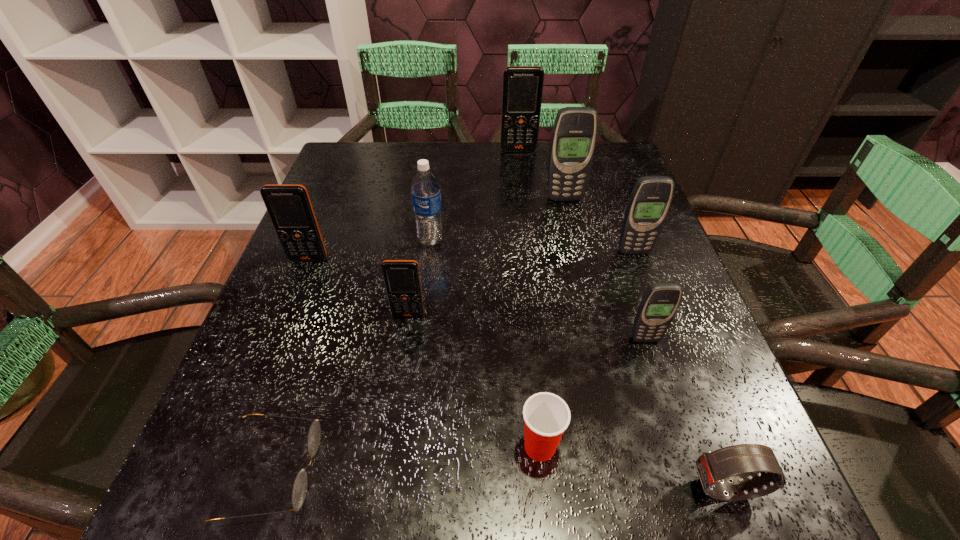
Where is `the second nearest cellular telephone`? the second nearest cellular telephone is located at coordinates (402, 281).

At what (x,y) coordinates should I click in order to perform the action: click on the smallest gray cellular telephone. Please return your answer as a coordinate pair (x, y). Image resolution: width=960 pixels, height=540 pixels. Looking at the image, I should click on (660, 302).

Where is `the nearest cellular telephone`? Image resolution: width=960 pixels, height=540 pixels. the nearest cellular telephone is located at coordinates (660, 302).

Identify the location of Dixie cup. (546, 416).

Where is `watch`? watch is located at coordinates (734, 462).

Find the location of a particular element. This screenshot has width=960, height=540. gold spectacles is located at coordinates (299, 491).

This screenshot has height=540, width=960. I want to click on the shortest object, so click(299, 491).

You are a GUI agent. You are given a task and a screenshot of the screen. Output one action in this format:
    pyautogui.click(x=<x>, y=<y>)
    Task: Click on the vacant space located 0.220m on the screen of the rightmost orange cellular telephone
    This screenshot has height=540, width=960.
    Given the screenshot: What is the action you would take?
    pyautogui.click(x=524, y=199)

Locate an element on the screen. This screenshot has width=960, height=540. free spot located on the screen of the farthest gray cellular telephone is located at coordinates (588, 298).

At what (x,y) coordinates should I click in order to perform the action: click on vacant space situated on the back of the water bottle. Please return your answer as a coordinate pair (x, y). Looking at the image, I should click on (440, 170).